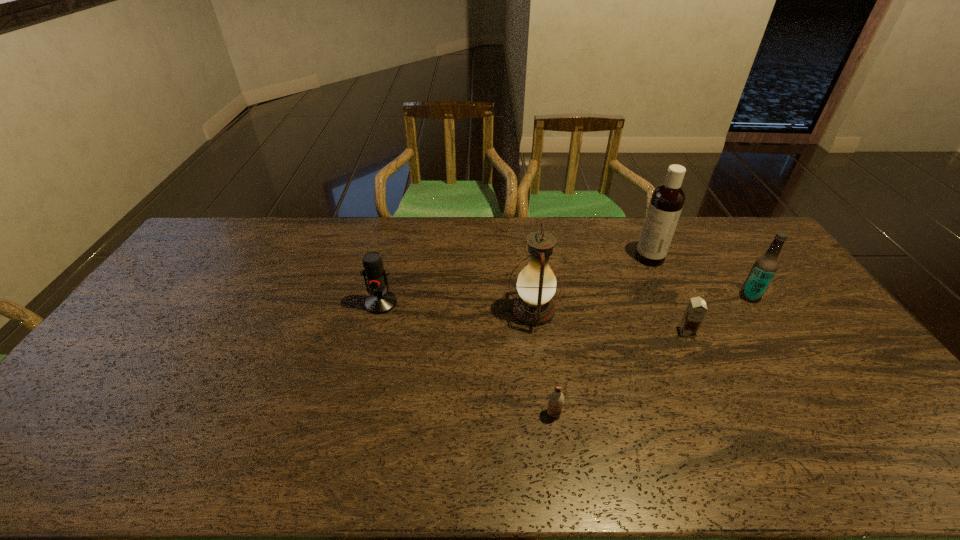
Locate an element on the screen. This screenshot has width=960, height=540. object situated at the far edge is located at coordinates (667, 200).

Locate an element on the screen. vacant space at the far edge of the desktop is located at coordinates click(596, 236).

Image resolution: width=960 pixels, height=540 pixels. I want to click on vacant space at the near edge, so click(772, 478).

Find the location of a particular element. Image resolution: width=960 pixels, height=540 pixels. vacant space at the left edge of the desktop is located at coordinates (99, 423).

The height and width of the screenshot is (540, 960). Find the location of `free spot at the right edge of the desktop`. free spot at the right edge of the desktop is located at coordinates (777, 314).

Where is `free location at the far left corner`? free location at the far left corner is located at coordinates (237, 237).

The width and height of the screenshot is (960, 540). I want to click on blank region between the microphone and the rightmost object, so click(565, 300).

Where is `free spot between the shorter chocolate milk and the dishwasher detergent`? The image size is (960, 540). free spot between the shorter chocolate milk and the dishwasher detergent is located at coordinates (602, 336).

Identify the location of empty space between the farthest object and the nearer chocolate milk. (602, 336).

At what (x,y) coordinates should I click in order to perform the action: click on vacant point located between the left chocolate milk and the taller chocolate milk. Please return your answer as a coordinate pair (x, y). This screenshot has height=540, width=960. Looking at the image, I should click on (620, 373).